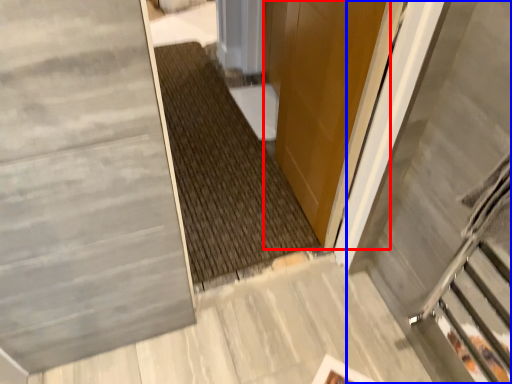
Question: Which point is closer to the camera, door (highlighted by a red box) or escalator (highlighted by a blue box)?

Choices:
 (A) door
 (B) escalator

Answer: (B)